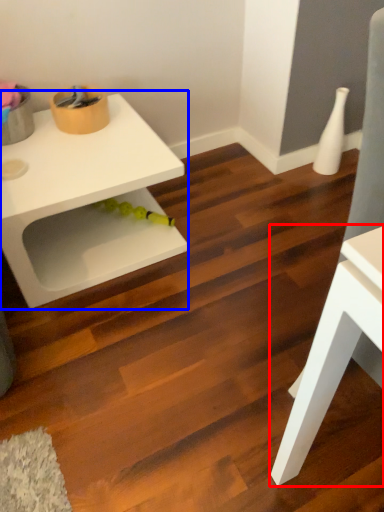
Question: Among these objects, which one is nearest to the camera, table (highlighted by a red box) or table (highlighted by a blue box)?

Choices:
 (A) table
 (B) table

Answer: (A)